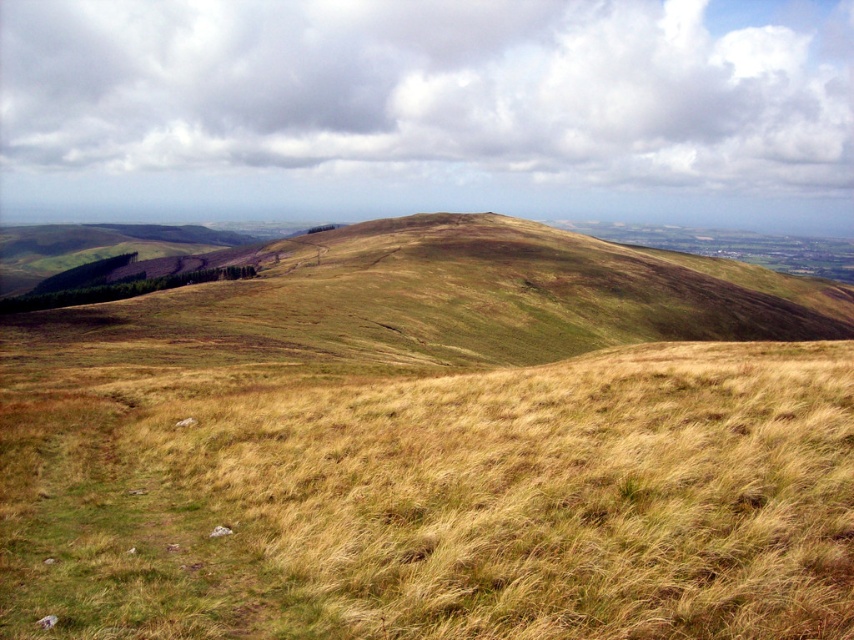
Question: Among these points, which one is farthest from the camera?

Choices:
 (A) (328, 348)
 (B) (16, 576)

Answer: (A)

Question: Which point is closer to the camera?

Choices:
 (A) green grassy hillside at center
 (B) dry grass at center

Answer: (B)

Question: Can you confirm if dry grass at center is smaller than green grassy hillside at center?

Choices:
 (A) no
 (B) yes

Answer: (B)

Question: Does dry grass at center have a larger size compared to green grassy hillside at center?

Choices:
 (A) yes
 (B) no

Answer: (B)

Question: Is dry grass at center to the right of green grassy hillside at center from the viewer's perspective?

Choices:
 (A) no
 (B) yes

Answer: (B)

Question: Which object appears farthest from the camera in this image?

Choices:
 (A) green grassy hillside at center
 (B) dry grass at center

Answer: (A)